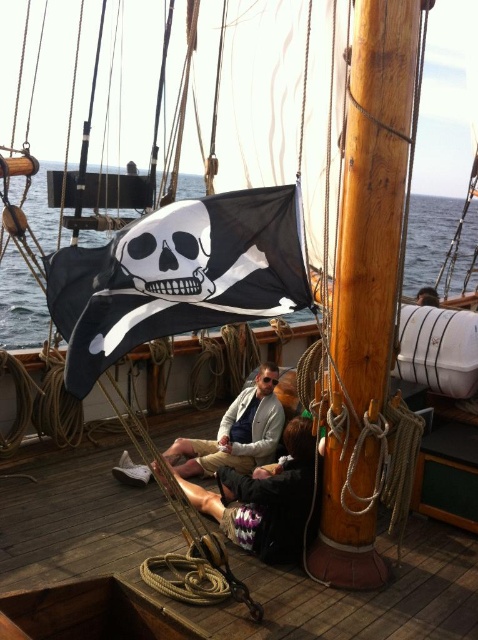
Question: Among these objects, which one is farthest from the camera?

Choices:
 (A) wooden deck at center
 (B) dark brown leather hammock at center
 (C) black matte skull at center
 (D) khaki cotton pants at center

Answer: (D)

Question: Which is farther from the black matte pirate flag at center?

Choices:
 (A) wooden deck at center
 (B) dark brown leather hammock at center
 (C) khaki cotton pants at center

Answer: (C)

Question: Where is dark brown leather hammock at center located in relation to khaki cotton pants at center in the image?

Choices:
 (A) below
 (B) above

Answer: (A)

Question: Is dark brown leather hammock at center smaller than khaki cotton pants at center?

Choices:
 (A) yes
 (B) no

Answer: (B)

Question: Is black matte pirate flag at center to the right of black matte skull at center from the viewer's perspective?

Choices:
 (A) no
 (B) yes

Answer: (B)

Question: Which of the following is the closest to the observer?

Choices:
 (A) (275, 486)
 (B) (78, 472)
 (C) (208, 221)

Answer: (C)